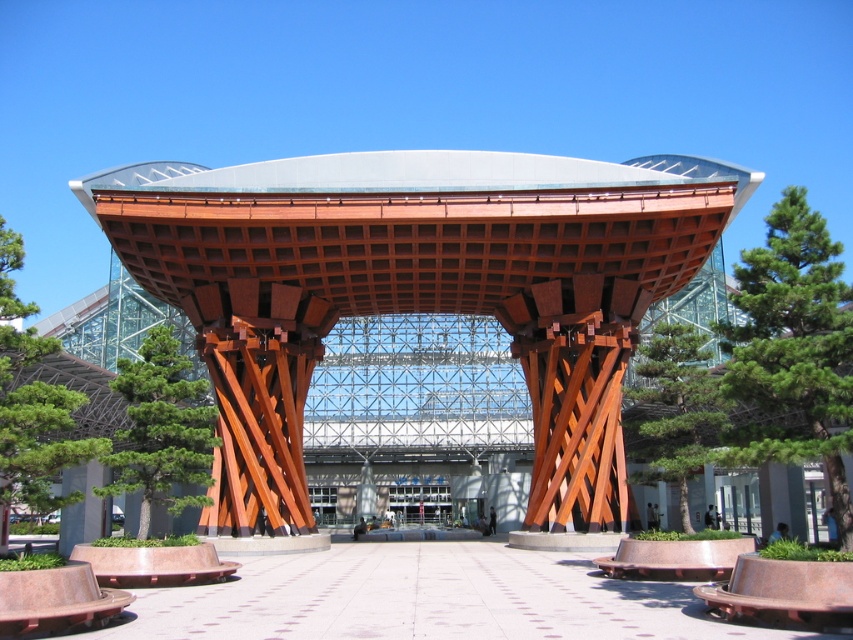
Who is more distant from viewer, (724, 376) or (161, 461)?

The point (161, 461) is more distant.

At what (x,y) coordinates should I click in order to perform the action: click on green leafy tree at center. Please return your answer as a coordinate pair (x, y). Looking at the image, I should click on (792, 353).

Image resolution: width=853 pixels, height=640 pixels. Identify the location of green leafy tree at center. (792, 353).

Which is more to the left, green matte tree at center or green leafy tree at left?

green leafy tree at left

Is green matte tree at center smaller than green leafy tree at left?

Actually, green matte tree at center might be larger than green leafy tree at left.

The height and width of the screenshot is (640, 853). What do you see at coordinates (161, 429) in the screenshot?
I see `green matte tree at center` at bounding box center [161, 429].

Identify the location of green matte tree at center. The width and height of the screenshot is (853, 640). (161, 429).

Between point (642, 257) and point (766, 436), which one is positioned in front?

Point (766, 436) is in front.

Where is `wooden lattice canopy at center`? The width and height of the screenshot is (853, 640). wooden lattice canopy at center is located at coordinates (416, 291).